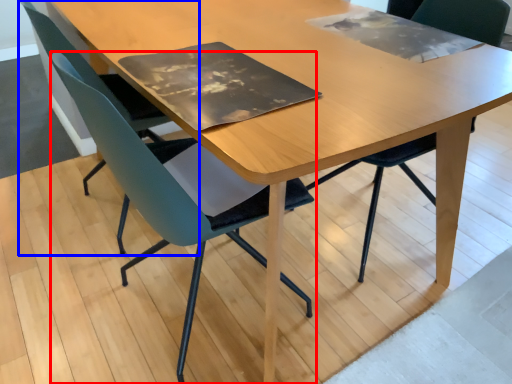
Question: Which point is further to the camera, chair (highlighted by a red box) or chair (highlighted by a blue box)?

Choices:
 (A) chair
 (B) chair

Answer: (B)